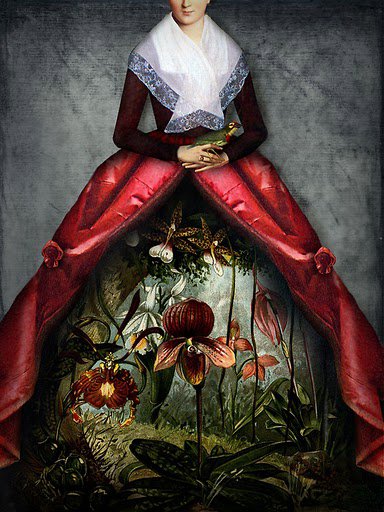
Find the location of `picture`. picture is located at coordinates (39, 15), (357, 20), (357, 457), (295, 498).